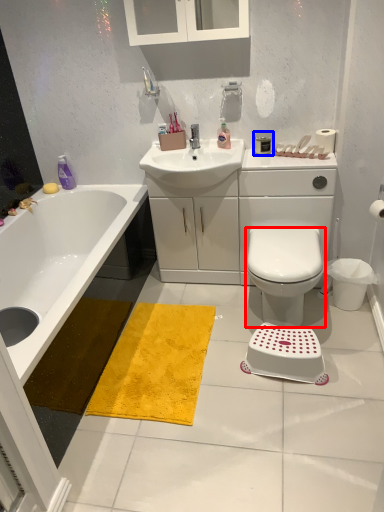
Question: Among these objects, which one is farthest to the camera, bidet (highlighted by a red box) or toiletry (highlighted by a blue box)?

Choices:
 (A) bidet
 (B) toiletry

Answer: (B)